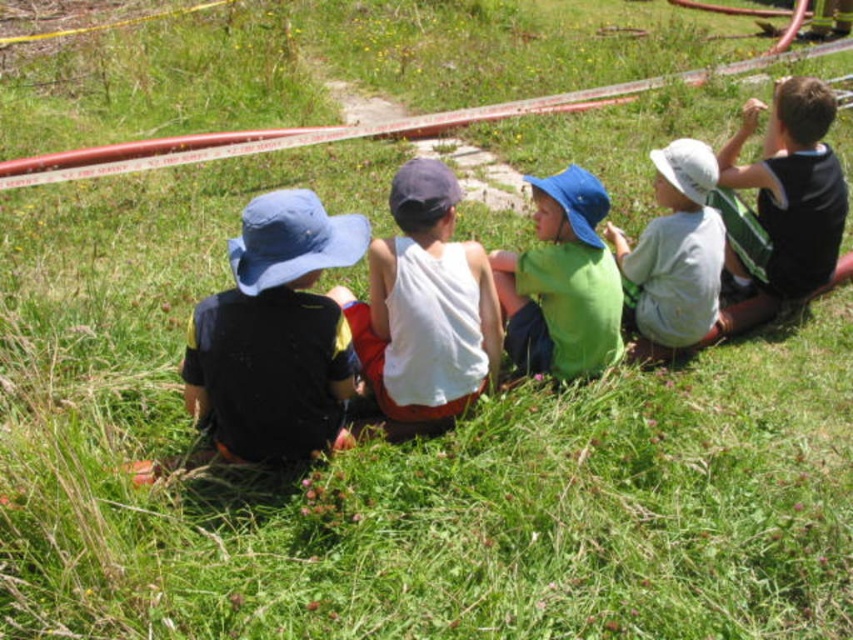
You are a photographer trying to capture a group shot of the children. You notice the matte blue hat at left and the green matte shirt at center. Which object should you focus on first if you want to ensure both are in the frame without moving the camera?

You should focus on the matte blue hat at left first because it is larger and will be easier to locate in the frame, ensuring the green matte shirt at center is also included.

You are a photographer trying to capture a group shot of the children. You notice the black jersey at upper right and the green matte shirt at center. To ensure both are visible in the frame, which direction should you move the camera slightly? Hint the direction is relative to the current camera position.

To include both the black jersey at upper right and the green matte shirt at center in the frame, move the camera slightly to the left. This adjustment will shift the composition so that the black jersey at upper right, which is positioned to the right of the green matte shirt at center, remains within the frame while also capturing the green matte shirt at center more centrally.

You are one of the children sitting on the grass. You see two points marked in the scene. The first point is at coordinate point (x=814, y=248) and the second is at point (x=532, y=276). Which point is closer to you?

Point (x=532, y=276) is closer to you because it is in front of point (x=814, y=248).